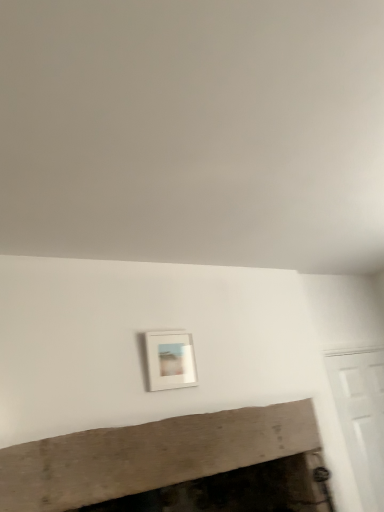
Question: Relative to white matte picture frame at center, is wooden mantel at lower center in front or behind?

Choices:
 (A) front
 (B) behind

Answer: (A)

Question: Is wooden mantel at lower center spatially inside white matte picture frame at center, or outside of it?

Choices:
 (A) outside
 (B) inside

Answer: (A)

Question: Considering the relative positions of wooden mantel at lower center and white matte picture frame at center in the image provided, is wooden mantel at lower center to the left or to the right of white matte picture frame at center?

Choices:
 (A) left
 (B) right

Answer: (A)

Question: Relative to wooden mantel at lower center, is white matte picture frame at center in front or behind?

Choices:
 (A) front
 (B) behind

Answer: (B)

Question: Visually, is white matte picture frame at center positioned to the left or to the right of wooden mantel at lower center?

Choices:
 (A) right
 (B) left

Answer: (A)

Question: Considering the positions of white matte picture frame at center and wooden mantel at lower center in the image, is white matte picture frame at center taller or shorter than wooden mantel at lower center?

Choices:
 (A) short
 (B) tall

Answer: (B)

Question: Considering the positions of point (193, 348) and point (56, 508), is point (193, 348) closer or farther from the camera than point (56, 508)?

Choices:
 (A) farther
 (B) closer

Answer: (A)